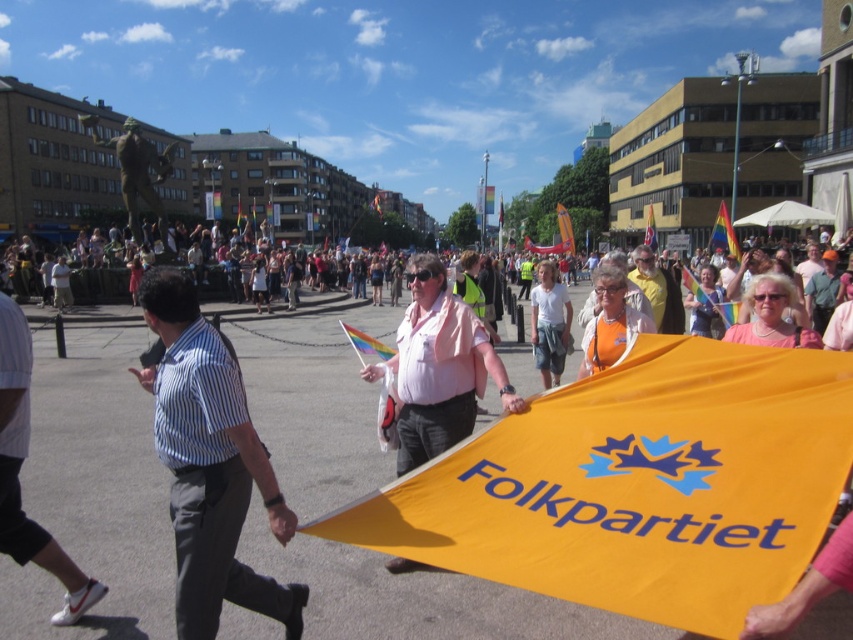
You are a photographer at the event and want to capture both the blue striped shirt at center and the rainbow fabric flag at upper center in a single photo. Given their sizes, which object should you focus on to ensure both are visible without cropping?

Since the blue striped shirt at center is smaller than the rainbow fabric flag at upper center, you should focus on the rainbow fabric flag at upper center to ensure both objects fit within the frame.

You are standing at the center of the square and see a point marked at coordinates (439, 368). What object in the scene is this point located on?

The point at coordinates (439, 368) is located on the pink fabric shirt at center.